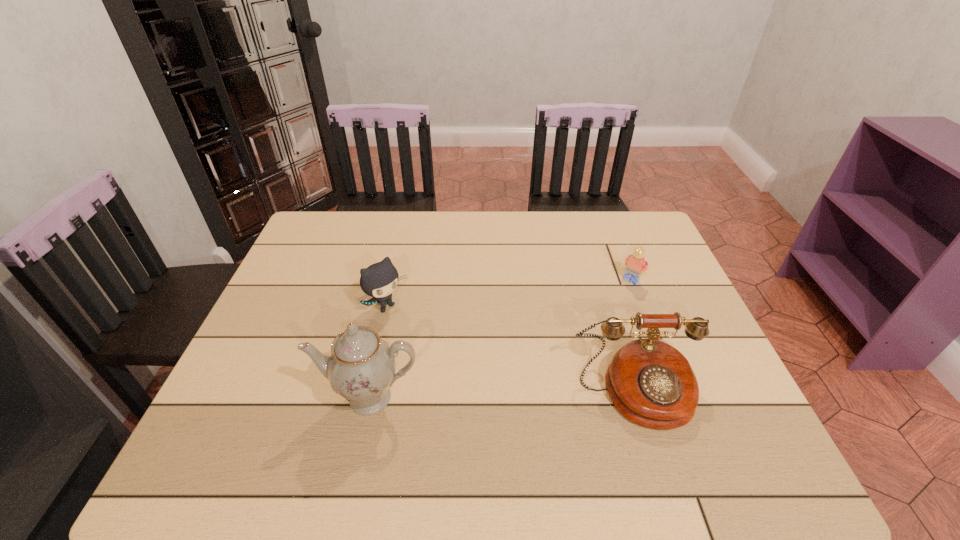
Point out which object is positioned as the third nearest to the tallest object. Please provide its 2D coordinates. Your answer should be formatted as a tuple, i.e. [(x, y)], where the tuple contains the x and y coordinates of a point satisfying the conditions above.

[(635, 264)]